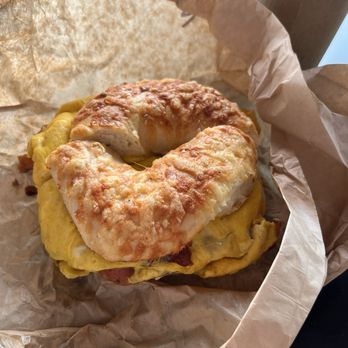
This screenshot has width=348, height=348. Find the location of `table`. table is located at coordinates (331, 329).